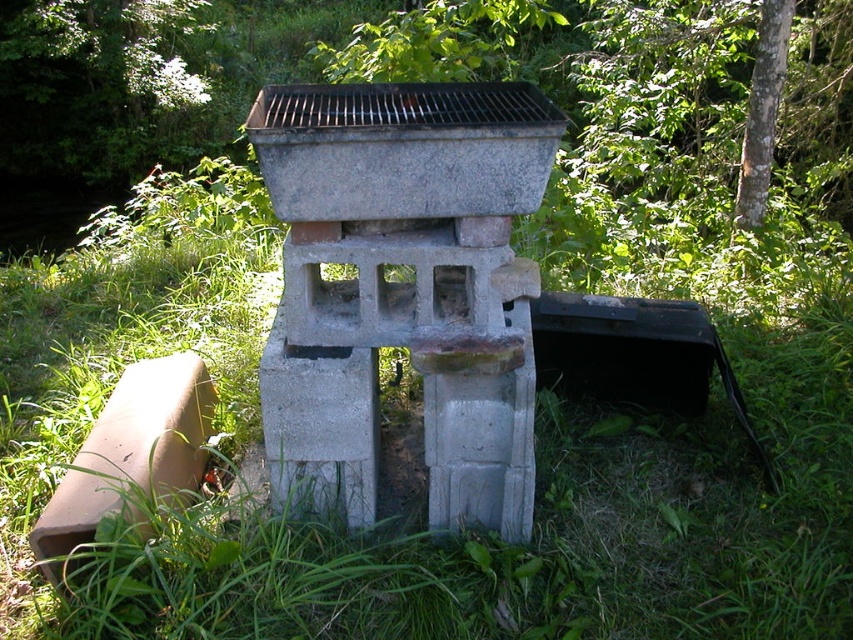
Question: Can you confirm if green grass at center is wider than green leafy tree at upper center?

Choices:
 (A) no
 (B) yes

Answer: (B)

Question: Which object appears farthest from the camera in this image?

Choices:
 (A) green grass at center
 (B) green leafy tree at upper center

Answer: (B)

Question: Can you confirm if green grass at center is thinner than green leafy tree at upper center?

Choices:
 (A) no
 (B) yes

Answer: (A)

Question: Is green grass at center wider than green leafy tree at upper center?

Choices:
 (A) no
 (B) yes

Answer: (B)

Question: Which point appears closest to the camera in this image?

Choices:
 (A) (766, 193)
 (B) (7, 380)

Answer: (B)

Question: Among these objects, which one is nearest to the camera?

Choices:
 (A) green leafy tree at upper center
 (B) green grass at center

Answer: (B)